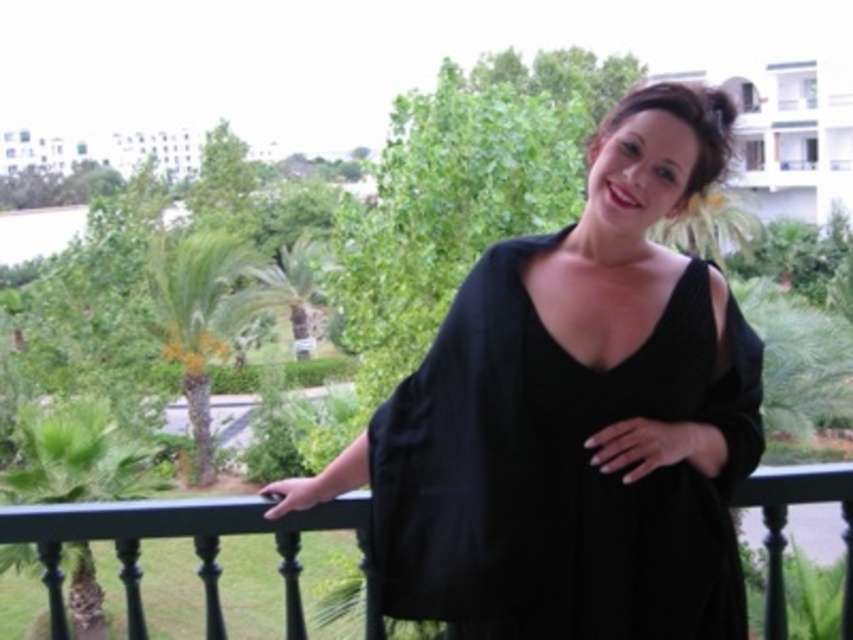
Question: Is black matte dress at center thinner than black painted wood at center?

Choices:
 (A) no
 (B) yes

Answer: (B)

Question: Which object is positioned closest to the black fabric balcony at upper right?

Choices:
 (A) black matte dress at center
 (B) black painted wood at center

Answer: (A)

Question: Is black matte dress at center above black painted wood at center?

Choices:
 (A) no
 (B) yes

Answer: (B)

Question: Is black matte dress at center positioned behind black painted wood at center?

Choices:
 (A) yes
 (B) no

Answer: (B)

Question: Which object appears farthest from the camera in this image?

Choices:
 (A) black painted wood at center
 (B) black fabric balcony at upper right
 (C) black matte dress at center

Answer: (A)

Question: Estimate the real-world distances between objects in this image. Which object is closer to the black painted wood at center?

Choices:
 (A) black matte dress at center
 (B) black fabric balcony at upper right

Answer: (A)